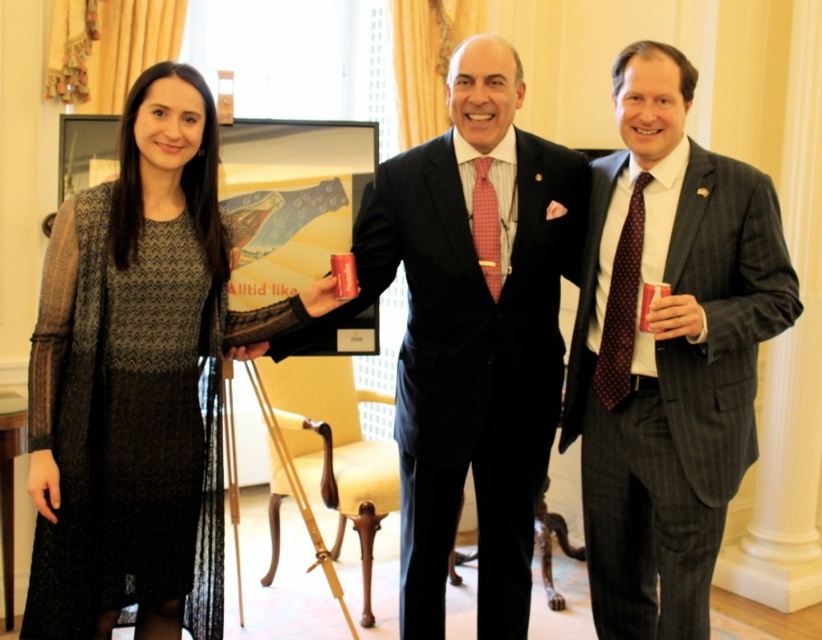
You are a photographer setting up for a group photo. You need to ensure that the matte black suit at center and the polka dot silk tie at right are both visible in the frame. Given their sizes, which one might require you to adjust the camera angle to ensure it is fully captured?

The matte black suit at center is taller than the polka dot silk tie at right, so you might need to adjust the camera angle to ensure the matte black suit at center is fully captured.

You are a photographer trying to capture a group photo of the knitted wool dress at left and the polka dot silk tie at right. Since you want to ensure both subjects are in focus, you need to know their heights. Which one is taller?

The knitted wool dress at left is much taller than the polka dot silk tie at right.